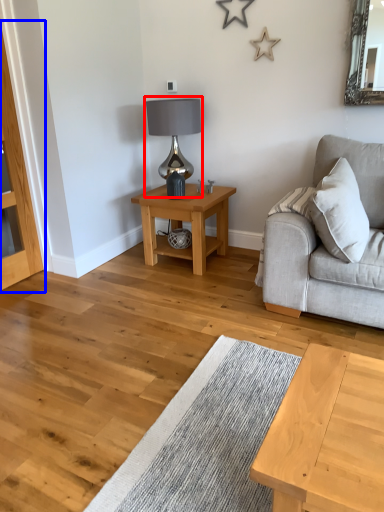
Question: Among these objects, which one is nearest to the camera, table lamp (highlighted by a red box) or dresser (highlighted by a blue box)?

Choices:
 (A) table lamp
 (B) dresser

Answer: (B)